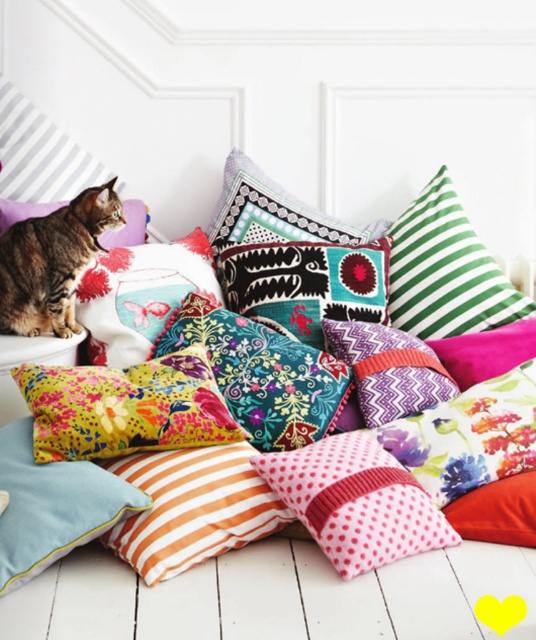
You are standing in the room and want to place a small plant pot on the floor. The plant pot requires a spot that is exactly 5 feet away from you. Is the point at point coordinates point (x=94, y=422) suitable for placing the plant pot?

The distance of point (x=94, y=422) from viewer is 4.92 feet, which is slightly less than 5 feet. Therefore, the point at point coordinates point (x=94, y=422) is not exactly 5 feet away and may not be suitable for placing the plant pot.

You are a photographer standing 1.2 meters away from the light blue cotton cushion at lower left. Can you reach it without moving your feet?

The light blue cotton cushion at lower left is 1.30 meters away from the viewer. Since you are standing 1.2 meters away, you can just barely reach it without moving your feet.

You are trying to reach the floral velvet cushion at center to place a small toy on it. However, there is a pink dotted fabric pillow at center in the way. Can you move the pillow to access the cushion?

The floral velvet cushion at center is located above the pink dotted fabric pillow at center, so you can simply move the pink dotted fabric pillow at center out of the way to access the cushion.